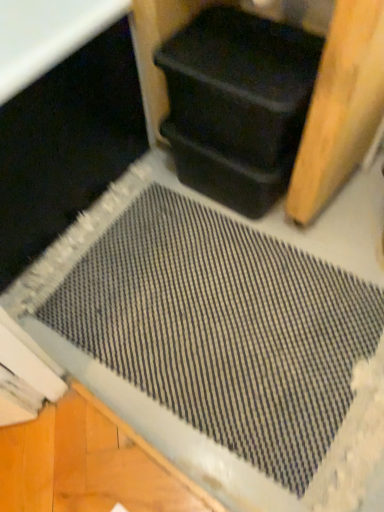
At what (x,y) coordinates should I click in order to perform the action: click on black plastic container at upper center. Please return your answer as a coordinate pair (x, y). This screenshot has width=384, height=512. Looking at the image, I should click on (264, 95).

This screenshot has height=512, width=384. Describe the element at coordinates (264, 95) in the screenshot. I see `black plastic container at upper center` at that location.

You are a GUI agent. You are given a task and a screenshot of the screen. Output one action in this format:
    pyautogui.click(x=<x>, y=<y>)
    Task: Click on the black plastic container at upper right
    
    Given the screenshot: What is the action you would take?
    pyautogui.click(x=240, y=84)

The height and width of the screenshot is (512, 384). What do you see at coordinates (240, 84) in the screenshot?
I see `black plastic container at upper right` at bounding box center [240, 84].

Identify the location of black plastic container at upper center. (264, 95).

Which is more to the left, black plastic container at upper right or black plastic container at upper center?

Positioned to the left is black plastic container at upper right.

Considering the positions of objects black plastic container at upper right and black plastic container at upper center in the image provided, who is in front, black plastic container at upper right or black plastic container at upper center?

black plastic container at upper center is more forward.

Is point (275, 74) farther from viewer compared to point (245, 119)?

No, it is in front of (245, 119).

From the image's perspective, is black plastic container at upper right located beneath black plastic container at upper center?

Indeed, from the image's perspective, black plastic container at upper right is shown beneath black plastic container at upper center.

From a real-world perspective, which is physically below, black plastic container at upper right or black plastic container at upper center?

black plastic container at upper center is physically lower.

Considering the relative sizes of black plastic container at upper right and black plastic container at upper center in the image provided, is black plastic container at upper right thinner than black plastic container at upper center?

Indeed, black plastic container at upper right has a lesser width compared to black plastic container at upper center.

Consider the image. Considering the sizes of objects black plastic container at upper right and black plastic container at upper center in the image provided, who is taller, black plastic container at upper right or black plastic container at upper center?

black plastic container at upper center is taller.

Does black plastic container at upper right have a larger size compared to black plastic container at upper center?

No.

Is black plastic container at upper center completely or partially inside black plastic container at upper right?

No, black plastic container at upper right does not contain black plastic container at upper center.

Is black plastic container at upper right far away from black plastic container at upper center?

black plastic container at upper right is actually quite close to black plastic container at upper center.

From the picture: Is black plastic container at upper right oriented away from black plastic container at upper center?

Yes, black plastic container at upper center is at the back of black plastic container at upper right.

Based on the photo, can you tell me how much black plastic container at upper right and black plastic container at upper center differ in facing direction?

The angle between the facing direction of black plastic container at upper right and the facing direction of black plastic container at upper center is 2.42 degrees.

Locate an element on the screen. The width and height of the screenshot is (384, 512). wide behind the black plastic container at upper center is located at coordinates pyautogui.click(x=240, y=84).

Which object is positioned more to the right, black plastic container at upper center or black plastic container at upper right?

From the viewer's perspective, black plastic container at upper center appears more on the right side.

Which is behind, black plastic container at upper center or black plastic container at upper right?

Positioned behind is black plastic container at upper right.

Does point (198, 42) come behind point (295, 134)?

That is True.

From the image's perspective, which one is positioned higher, black plastic container at upper center or black plastic container at upper right?

black plastic container at upper center, from the image's perspective.

From a real-world perspective, is black plastic container at upper center positioned above or below black plastic container at upper right?

From a real-world perspective, black plastic container at upper center is physically below black plastic container at upper right.

In terms of width, does black plastic container at upper center look wider or thinner when compared to black plastic container at upper right?

Clearly, black plastic container at upper center has more width compared to black plastic container at upper right.

Based on the photo, considering the relative sizes of black plastic container at upper center and black plastic container at upper right in the image provided, is black plastic container at upper center shorter than black plastic container at upper right?

In fact, black plastic container at upper center may be taller than black plastic container at upper right.

Between black plastic container at upper center and black plastic container at upper right, which one has smaller size?

black plastic container at upper right is smaller.

Is black plastic container at upper right a part of black plastic container at upper center?

Yes, black plastic container at upper center contains black plastic container at upper right.

Is black plastic container at upper center beside black plastic container at upper right?

Yes, black plastic container at upper center is with black plastic container at upper right.

Does black plastic container at upper center turn towards black plastic container at upper right?

Yes.

Measure the distance from black plastic container at upper center to black plastic container at upper right.

black plastic container at upper center and black plastic container at upper right are 1.48 inches apart.

Locate an element on the screen. The width and height of the screenshot is (384, 512). wood below the black plastic container at upper right (from a real-world perspective) is located at coordinates (264, 95).

This screenshot has width=384, height=512. I want to click on wood in front of the black plastic container at upper right, so click(x=264, y=95).

In order to click on wide above the black plastic container at upper center (from a real-world perspective) in this screenshot , I will do `click(240, 84)`.